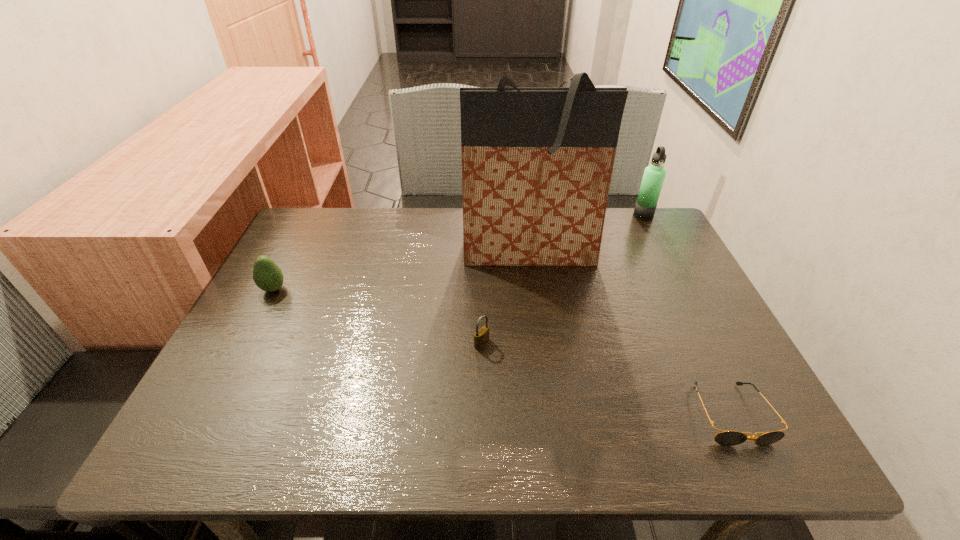
Find the location of a particular element. This screenshot has height=540, width=960. empty space that is in between the thermos bottle and the padlock is located at coordinates (563, 279).

In order to click on free space between the nearest object and the second nearest object in this screenshot , I will do tap(606, 379).

Locate an element on the screen. The image size is (960, 540). empty space between the thermos bottle and the second shortest object is located at coordinates (563, 279).

At what (x,y) coordinates should I click in order to perform the action: click on free spot between the thermos bottle and the third nearest object. Please return your answer as a coordinate pair (x, y). Looking at the image, I should click on (458, 252).

You are a GUI agent. You are given a task and a screenshot of the screen. Output one action in this format:
    pyautogui.click(x=<x>, y=<y>)
    Task: Click on the unoccupied position between the sunglasses and the tallest object
    
    Given the screenshot: What is the action you would take?
    pyautogui.click(x=630, y=333)

The image size is (960, 540). I want to click on empty space between the fourth nearest object and the nearest object, so click(630, 333).

Where is `vacant point located between the shortest object and the fourth shortest object`? This screenshot has height=540, width=960. vacant point located between the shortest object and the fourth shortest object is located at coordinates (686, 314).

At what (x,y) coordinates should I click in order to perform the action: click on vacant region between the tallest object and the padlock. Please return your answer as a coordinate pair (x, y). Looking at the image, I should click on (505, 298).

Point out which object is positioned as the third nearest to the second farthest object. Please provide its 2D coordinates. Your answer should be formatted as a tuple, i.e. [(x, y)], where the tuple contains the x and y coordinates of a point satisfying the conditions above.

[(728, 438)]

Where is `object that is the closest to the second tallest object`? object that is the closest to the second tallest object is located at coordinates (537, 163).